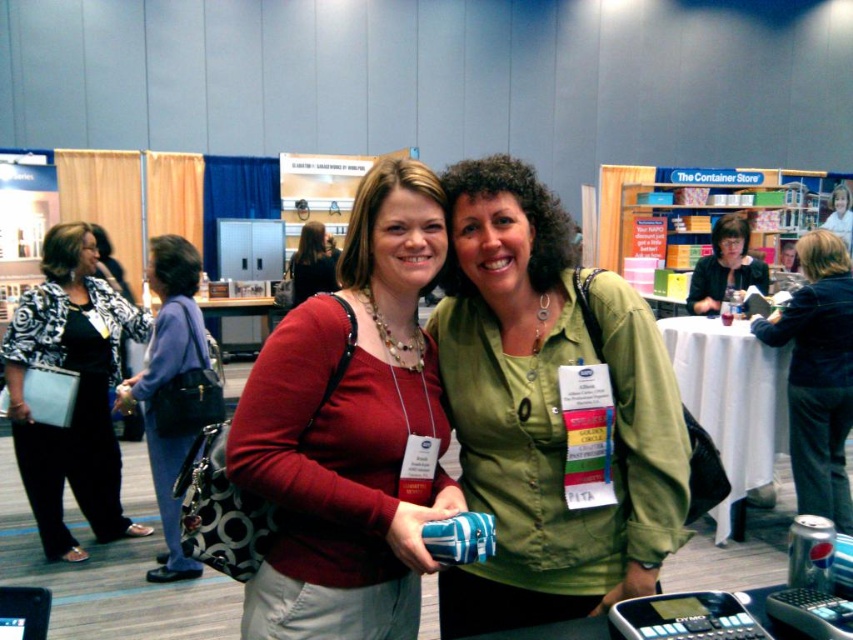
You are organizing a photo shoot and need to place a prop at the exact center of the image. The dark blue denim jacket at center is currently at point 0.586, 0.959. Is the jacket positioned at the image center?

The dark blue denim jacket at center is located at point (817, 374), which means it is not exactly at the image center since the exact center would be at coordinates (426, 320).

You are organizing a coat rack at a store and need to place the dark blue denim jacket at center and the matte black purse at center on adjacent hooks. The hooks are spaced 10 cm apart. Can both items fit side by side without overlapping?

The dark blue denim jacket at center is thinner than the matte black purse at center. Since the hooks are spaced 10 cm apart, the total width required would be the sum of both items. However, the exact widths are not provided, so we cannot confirm if they will fit without overlapping. Additional measurements are needed.

You are organizing a small gift bag for an event attendee. You have a matte black purse at center and a clear plastic bottle at center. Which item can you place vertically without tipping over?

The matte black purse at center is taller than the clear plastic bottle at center, so it can be placed vertically without tipping over.